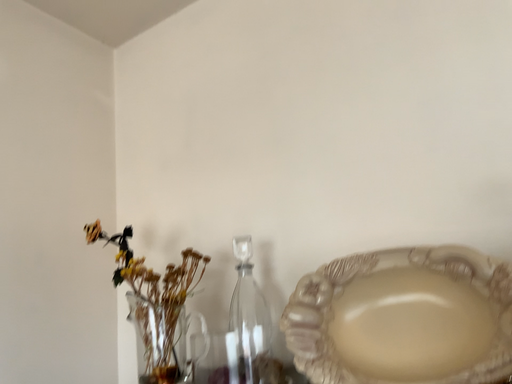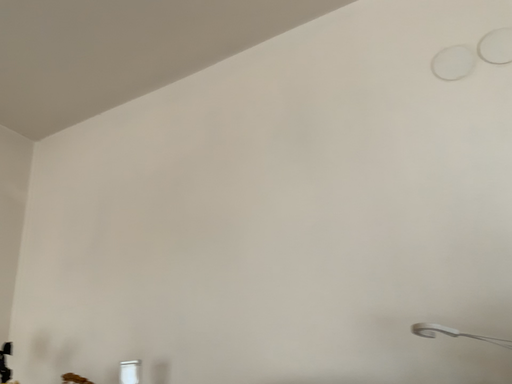
Question: Which way did the camera rotate in the video?

Choices:
 (A) rotated right
 (B) rotated left

Answer: (A)